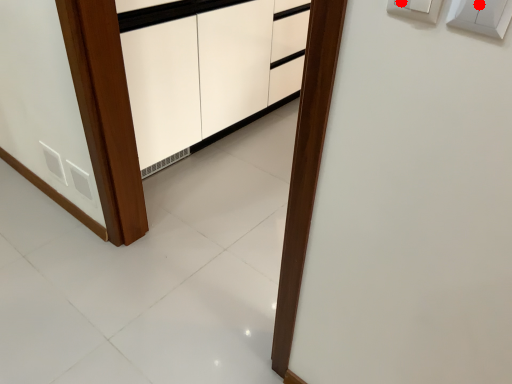
Question: Two points are circled on the image, labeled by A and B beside each circle. Among these points, which one is nearest to the camera?

Choices:
 (A) A is closer
 (B) B is closer

Answer: (B)